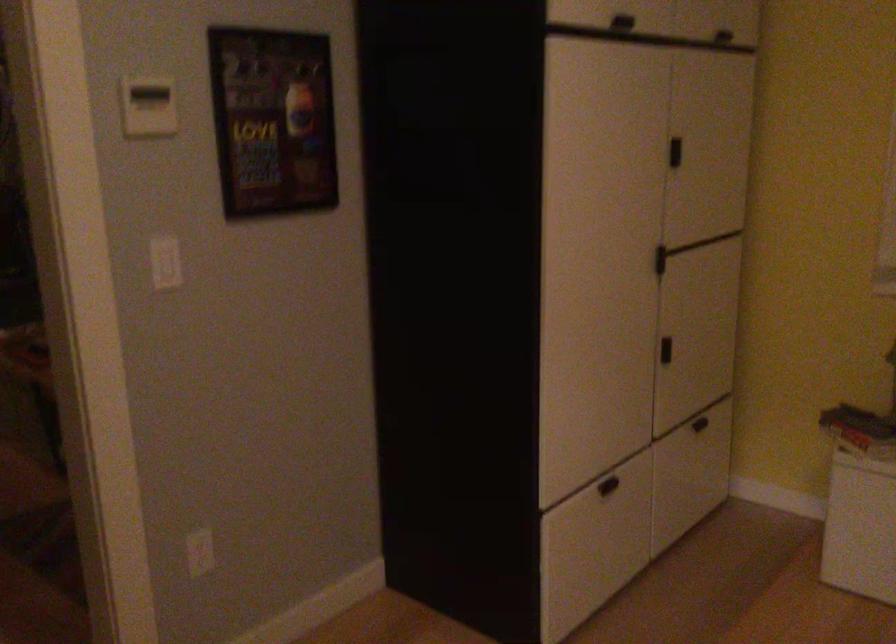
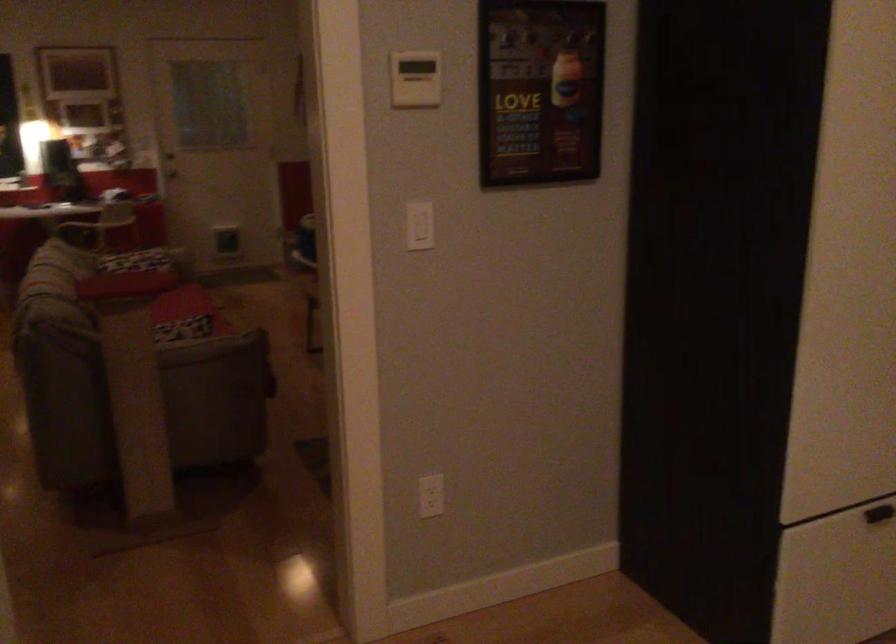
The point at [200,551] is marked in the first image. Where is the corresponding point in the second image?

(431, 496)